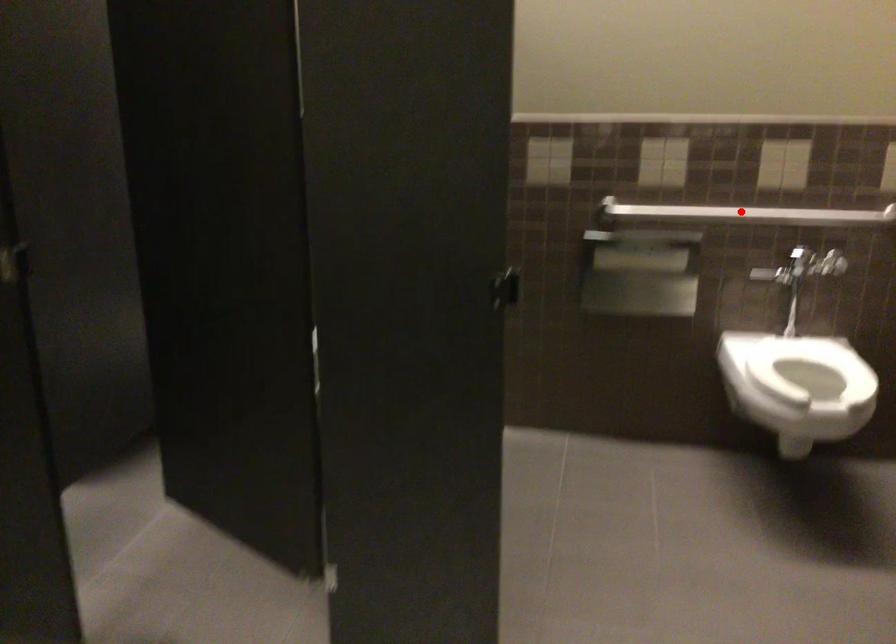
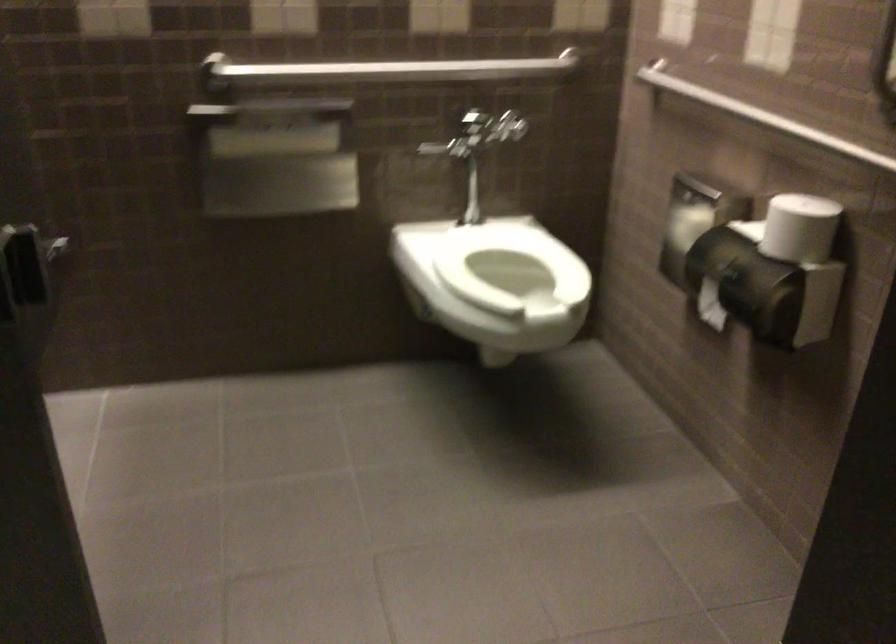
Locate, in the second image, the point that corresponds to the highlighted location in the first image.

(391, 69)